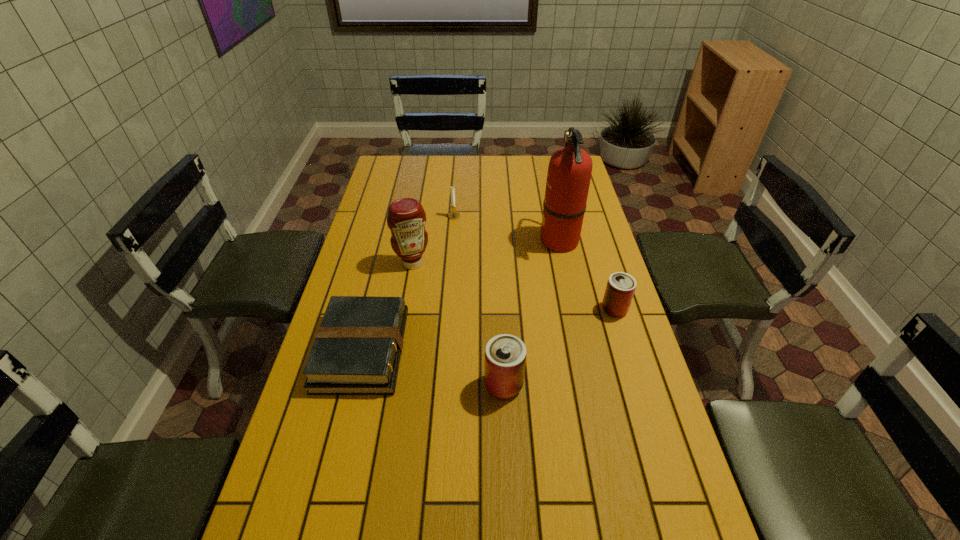
Locate an element on the screen. The width and height of the screenshot is (960, 540). can that is at the right edge is located at coordinates (621, 286).

The width and height of the screenshot is (960, 540). What are the coordinates of `fire extinguisher positioned at the right edge` in the screenshot? It's located at (569, 173).

At what (x,y) coordinates should I click in order to perform the action: click on blank area at the far edge. Please return your answer as a coordinate pair (x, y). Image resolution: width=960 pixels, height=540 pixels. Looking at the image, I should click on (430, 170).

Identify the location of free space at the left edge. Image resolution: width=960 pixels, height=540 pixels. (385, 251).

The image size is (960, 540). In the image, there is a desktop. Find the location of `free space at the right edge`. free space at the right edge is located at coordinates (652, 434).

Where is `free area in between the farther can and the fifth object from left to right`? The height and width of the screenshot is (540, 960). free area in between the farther can and the fifth object from left to right is located at coordinates (587, 275).

Locate an element on the screen. The width and height of the screenshot is (960, 540). vacant area that lies between the hardback book and the fire extinguisher is located at coordinates click(x=461, y=295).

Locate an element on the screen. free space between the fourth object from right to left and the second tallest object is located at coordinates (433, 240).

Identify the location of free space between the candle holder and the nearer can. Image resolution: width=960 pixels, height=540 pixels. (479, 301).

This screenshot has height=540, width=960. I want to click on free spot between the shorter can and the tallest object, so click(x=587, y=275).